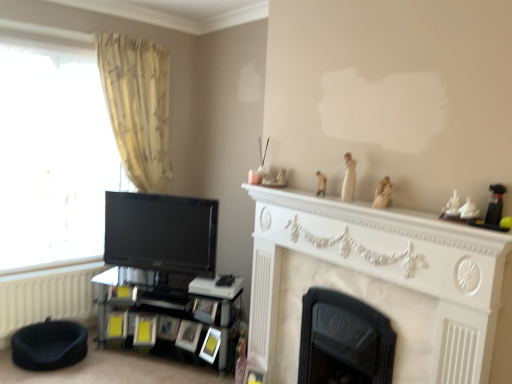
Where is `vacant area on top of dark blue fabric bean bag chair at lower left (from a real-world perspective)`? vacant area on top of dark blue fabric bean bag chair at lower left (from a real-world perspective) is located at coordinates (52, 327).